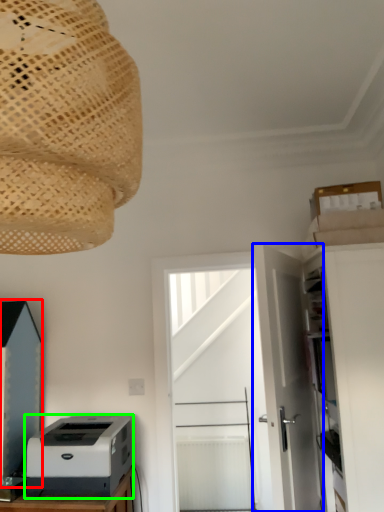
Question: Which object is positioned farthest from cabinetry (highlighted by a red box)? Select from door (highlighted by a blue box) and printer (highlighted by a green box).

Choices:
 (A) door
 (B) printer

Answer: (A)